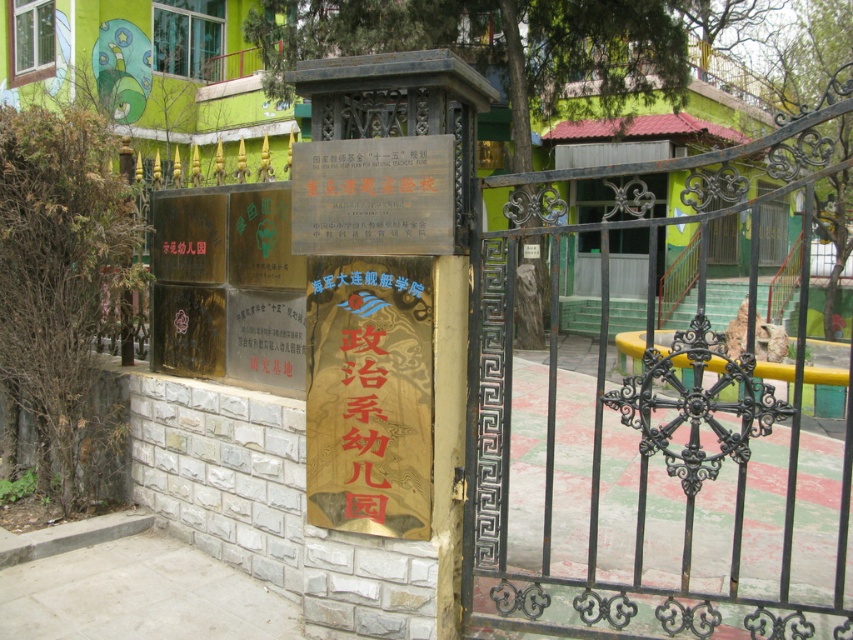
You are standing at the entrance of the kindergarten and want to locate the gold textured sign at center. According to the scene description, where should you look relative to the gate?

The gold textured sign at center is located at the center of the scene, so you should look straight ahead towards the center of the gate area to find it.

You are a parent visiting a kindergarten and want to read both the gold textured sign at center and the gold metallic sign at center. Since you can only move forward or backward, which sign should you move closer to in order to read both clearly?

You should move closer to the gold textured sign at center first because the gold metallic sign at center is behind it. By moving forward towards the gold textured sign at center, you can read it clearly, and then step back slightly to view the gold metallic sign at center behind it.

You are a parent trying to enter the kindergarten. The black wrought iron gate at center is partially open. Can you walk through the gate without touching the gold metallic sign at center?

The black wrought iron gate at center is wider than the gold metallic sign at center. Since the gate is partially open, you should be able to walk through the opening without touching the gold metallic sign at center as long as you stay within the gate.